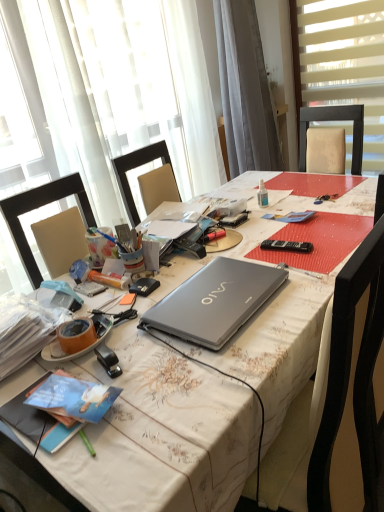
Identify the location of vacant area that lies between clear plastic bottle at center and black plastic remote control at center. (278, 228).